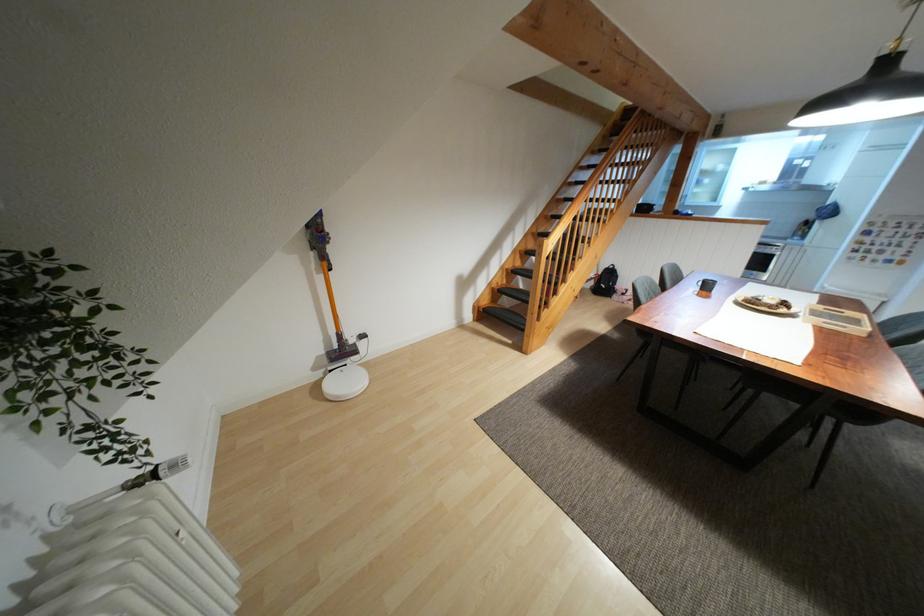
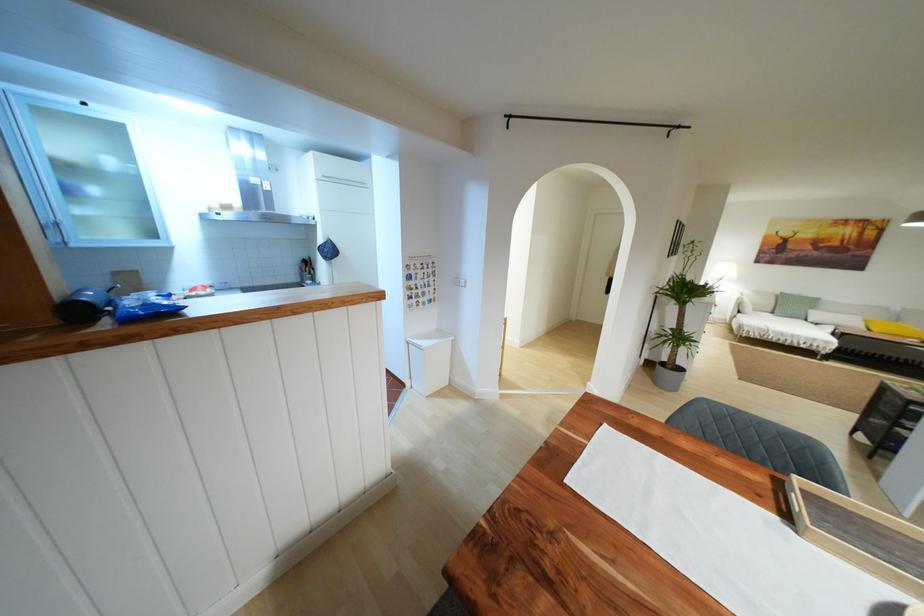
Where in the second image is the point corresponding to (x=881, y=294) from the first image?

(439, 331)